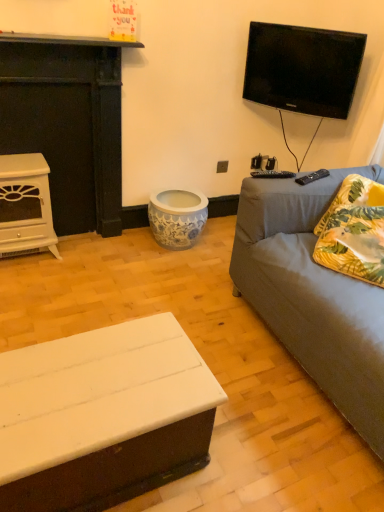
The width and height of the screenshot is (384, 512). Find the location of `white matte coffee table at lower left`. white matte coffee table at lower left is located at coordinates (103, 416).

Considering the sizes of yellow floral fabric pillow at right and white glossy fireplace at left, which is counted as the first fireplace, starting from the bottom, in the image, is yellow floral fabric pillow at right wider or thinner than white glossy fireplace at left, which is counted as the first fireplace, starting from the bottom,?

Considering their sizes, yellow floral fabric pillow at right looks broader than white glossy fireplace at left, which is counted as the first fireplace, starting from the bottom.

What's the angular difference between yellow floral fabric pillow at right and white glossy fireplace at left, which is counted as the first fireplace, starting from the bottom,'s facing directions?

The facing directions of yellow floral fabric pillow at right and white glossy fireplace at left, which is counted as the first fireplace, starting from the bottom, are 56.1 degrees apart.

From the image's perspective, is yellow floral fabric pillow at right above or below white glossy fireplace at left, which is counted as the 2th fireplace, starting from the top?

yellow floral fabric pillow at right is situated lower than white glossy fireplace at left, which is counted as the 2th fireplace, starting from the top, in the image.

Does yellow floral fabric pillow at right have a smaller size compared to white glossy fireplace at left, which is counted as the first fireplace, starting from the bottom?

Yes, yellow floral fabric pillow at right is smaller than white glossy fireplace at left, which is counted as the first fireplace, starting from the bottom.

Is white matte fireplace at left, arranged as the 1th fireplace when viewed from the top, positioned far away from white glossy fireplace at left, which is counted as the first fireplace, starting from the bottom?

white matte fireplace at left, arranged as the 1th fireplace when viewed from the top, is near white glossy fireplace at left, which is counted as the first fireplace, starting from the bottom, not far away.

Considering the positions of point (108, 103) and point (45, 177), is point (108, 103) closer or farther from the camera than point (45, 177)?

Point (108, 103).

Does white matte fireplace at left, arranged as the 1th fireplace when viewed from the top, appear on the right side of white glossy fireplace at left, which is counted as the first fireplace, starting from the bottom?

Yes, white matte fireplace at left, arranged as the 1th fireplace when viewed from the top, is to the right of white glossy fireplace at left, which is counted as the first fireplace, starting from the bottom.

Is white glossy fireplace at left, which is counted as the first fireplace, starting from the bottom, inside the boundaries of white matte fireplace at left, the 2th fireplace when ordered from bottom to top, or outside?

white glossy fireplace at left, which is counted as the first fireplace, starting from the bottom, is enclosed within white matte fireplace at left, the 2th fireplace when ordered from bottom to top.

Locate an element on the screen. fireplace above the white glossy fireplace at left, which is counted as the 2th fireplace, starting from the top (from a real-world perspective) is located at coordinates (67, 123).

From a real-world perspective, who is located lower, white glossy fireplace at left, which is counted as the 2th fireplace, starting from the top, or white matte fireplace at left, arranged as the 1th fireplace when viewed from the top?

From a 3D spatial view, white glossy fireplace at left, which is counted as the 2th fireplace, starting from the top, is below.

Can you tell me how much white glossy fireplace at left, which is counted as the 2th fireplace, starting from the top, and white matte fireplace at left, the 2th fireplace when ordered from bottom to top, differ in facing direction?

The angular difference between white glossy fireplace at left, which is counted as the 2th fireplace, starting from the top, and white matte fireplace at left, the 2th fireplace when ordered from bottom to top, is 0.402 degrees.

Who is shorter, gray fabric couch at right or black glossy tv at upper right?

With less height is black glossy tv at upper right.

Considering the positions of objects gray fabric couch at right and black glossy tv at upper right in the image provided, who is more to the right, gray fabric couch at right or black glossy tv at upper right?

Positioned to the right is gray fabric couch at right.

Looking at this image, is gray fabric couch at right facing towards black glossy tv at upper right?

No, gray fabric couch at right does not turn towards black glossy tv at upper right.

Who is bigger, yellow floral fabric pillow at right or gray fabric couch at right?

Bigger between the two is gray fabric couch at right.

From the picture: Is yellow floral fabric pillow at right directly adjacent to gray fabric couch at right?

No, yellow floral fabric pillow at right is not next to gray fabric couch at right.

Considering the sizes of yellow floral fabric pillow at right and gray fabric couch at right in the image, is yellow floral fabric pillow at right wider or thinner than gray fabric couch at right?

Considering their sizes, yellow floral fabric pillow at right looks slimmer than gray fabric couch at right.

Does point (320, 257) appear closer or farther from the camera than point (351, 330)?

Point (320, 257) is farther from the camera than point (351, 330).

From the image's perspective, would you say yellow floral fabric pillow at right is positioned over black glossy tv at upper right?

No, from the image's perspective, yellow floral fabric pillow at right is not on top of black glossy tv at upper right.

Is yellow floral fabric pillow at right positioned with its back to black glossy tv at upper right?

yellow floral fabric pillow at right is not turned away from black glossy tv at upper right.

Does yellow floral fabric pillow at right lie behind black glossy tv at upper right?

No, yellow floral fabric pillow at right is closer to the viewer.

Could you tell me if white matte coffee table at lower left is facing yellow floral fabric pillow at right?

No, white matte coffee table at lower left does not turn towards yellow floral fabric pillow at right.

Considering the positions of objects white matte coffee table at lower left and yellow floral fabric pillow at right in the image provided, who is in front, white matte coffee table at lower left or yellow floral fabric pillow at right?

white matte coffee table at lower left is closer to the camera.

From a real-world perspective, is white matte coffee table at lower left located higher than yellow floral fabric pillow at right?

No.

Between point (148, 356) and point (330, 258), which one is positioned in front?

The point (148, 356) is closer to the camera.

Find the location of a particular element. The height and width of the screenshot is (512, 384). the 2nd fireplace positioned below the yellow floral fabric pillow at right (from a real-world perspective) is located at coordinates (25, 206).

In the image, there is a white matte fireplace at left, the 2th fireplace when ordered from bottom to top. Where is `fireplace below it (from the image's perspective)`? Image resolution: width=384 pixels, height=512 pixels. fireplace below it (from the image's perspective) is located at coordinates click(25, 206).

Looking at the image, which one is located closer to yellow floral fabric pillow at right, white matte coffee table at lower left or gray fabric couch at right?

gray fabric couch at right is positioned closer to the anchor yellow floral fabric pillow at right.

Based on their spatial positions, is white matte fireplace at left, the 2th fireplace when ordered from bottom to top, or white matte coffee table at lower left closer to gray fabric couch at right?

white matte coffee table at lower left lies closer to gray fabric couch at right than the other object.

Looking at the image, which one is located further to white matte coffee table at lower left, yellow floral fabric pillow at right or white glossy fireplace at left, which is counted as the 2th fireplace, starting from the top?

white glossy fireplace at left, which is counted as the 2th fireplace, starting from the top, is further to white matte coffee table at lower left.

Consider the image. From the image, which object appears to be nearer to yellow floral fabric pillow at right, white matte fireplace at left, arranged as the 1th fireplace when viewed from the top, or black glossy tv at upper right?

black glossy tv at upper right is positioned closer to the anchor yellow floral fabric pillow at right.

Which object lies nearer to the anchor point yellow floral fabric pillow at right, white glossy fireplace at left, which is counted as the 2th fireplace, starting from the top, or gray fabric couch at right?

Based on the image, gray fabric couch at right appears to be nearer to yellow floral fabric pillow at right.

When comparing their distances from gray fabric couch at right, does white matte coffee table at lower left or black glossy tv at upper right seem closer?

The object closer to gray fabric couch at right is white matte coffee table at lower left.

When comparing their distances from white glossy fireplace at left, which is counted as the 2th fireplace, starting from the top, does gray fabric couch at right or white matte fireplace at left, arranged as the 1th fireplace when viewed from the top, seem closer?

white matte fireplace at left, arranged as the 1th fireplace when viewed from the top.

Based on their spatial positions, is white matte fireplace at left, arranged as the 1th fireplace when viewed from the top, or white glossy fireplace at left, which is counted as the first fireplace, starting from the bottom, closer to black glossy tv at upper right?

Based on the image, white matte fireplace at left, arranged as the 1th fireplace when viewed from the top, appears to be nearer to black glossy tv at upper right.

Where is `throw pillow located between white matte fireplace at left, arranged as the 1th fireplace when viewed from the top, and gray fabric couch at right in the left-right direction`? throw pillow located between white matte fireplace at left, arranged as the 1th fireplace when viewed from the top, and gray fabric couch at right in the left-right direction is located at coordinates (354, 231).

Image resolution: width=384 pixels, height=512 pixels. Identify the location of fireplace located between white glossy fireplace at left, which is counted as the first fireplace, starting from the bottom, and gray fabric couch at right in the left-right direction. (67, 123).

You are a GUI agent. You are given a task and a screenshot of the screen. Output one action in this format:
    pyautogui.click(x=<x>, y=<y>)
    Task: Click on the studio couch between black glossy tv at upper right and white matte coffee table at lower left in the up-down direction
    This screenshot has width=384, height=512.
    Given the screenshot: What is the action you would take?
    pyautogui.click(x=313, y=295)

Locate an element on the screen. coffee table located between white matte fireplace at left, arranged as the 1th fireplace when viewed from the top, and yellow floral fabric pillow at right in the left-right direction is located at coordinates (103, 416).